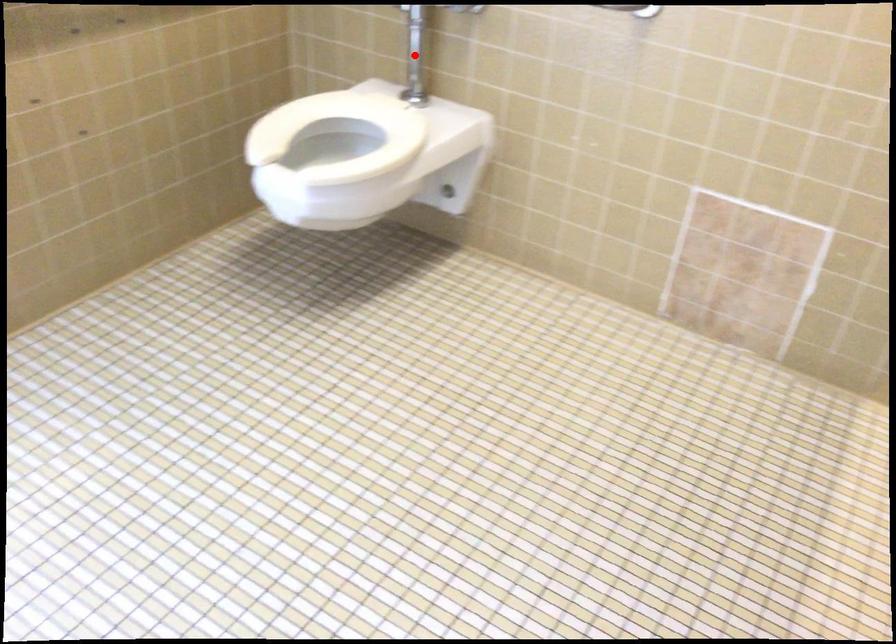
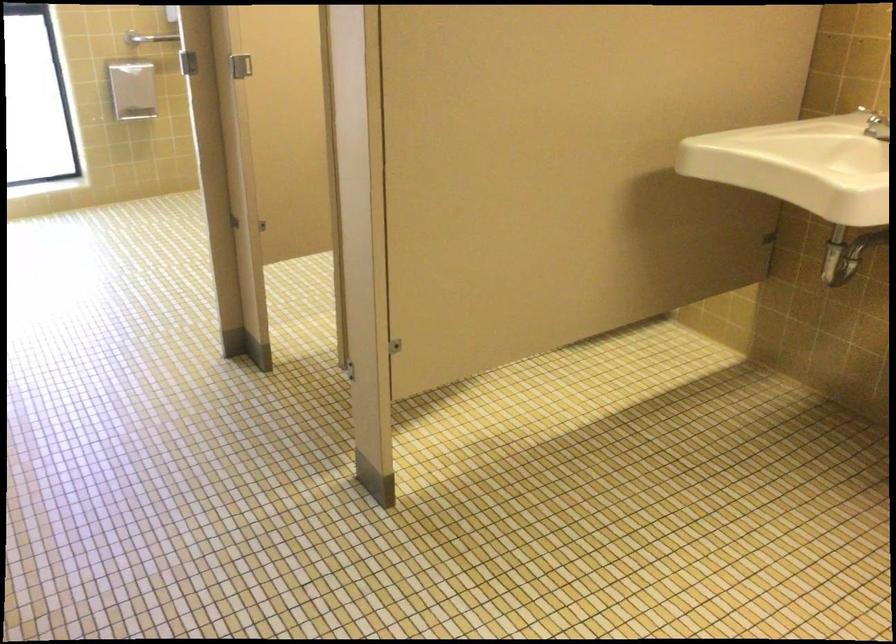
Question: I am providing you with two images of the same scene from different viewpoints. A red point is marked on the first image. At the location where the point appears in image 1, is it still visible in image 2?

Choices:
 (A) Yes
 (B) No

Answer: (B)